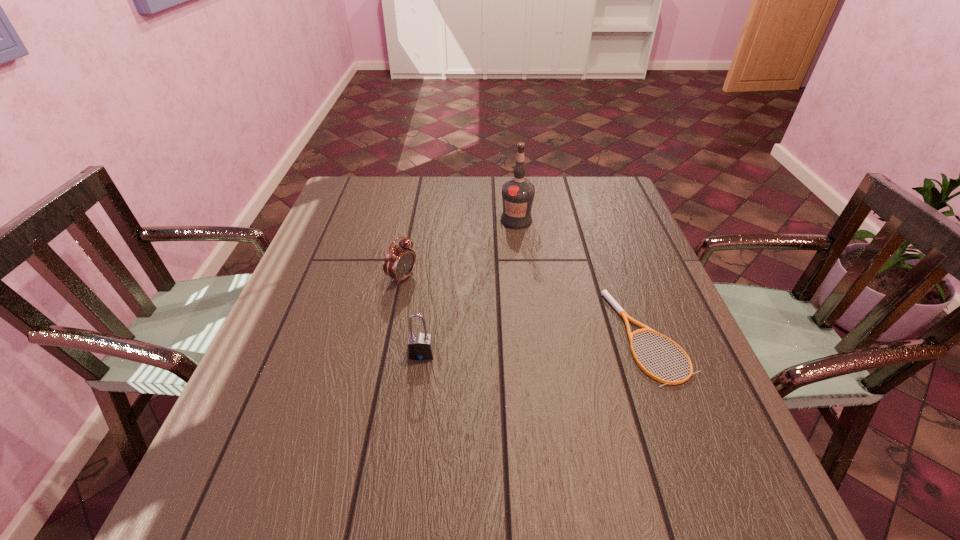
This screenshot has width=960, height=540. In order to click on vacant space at the right edge of the desktop in this screenshot , I will do `click(688, 389)`.

Where is `vacant space at the far left corner of the desktop`? This screenshot has height=540, width=960. vacant space at the far left corner of the desktop is located at coordinates (371, 208).

At what (x,y) coordinates should I click in order to perform the action: click on free spot at the far right corner of the desktop. Please return your answer as a coordinate pair (x, y). The width and height of the screenshot is (960, 540). Looking at the image, I should click on (588, 211).

Identify the location of free space that is in between the third object from left to right and the alarm clock. (459, 249).

The height and width of the screenshot is (540, 960). I want to click on empty space that is in between the farthest object and the tennis racket, so click(583, 278).

The height and width of the screenshot is (540, 960). Find the location of `vacant region between the tallest object and the third object from right to left`. vacant region between the tallest object and the third object from right to left is located at coordinates (469, 287).

At what (x,y) coordinates should I click in order to perform the action: click on empty space between the tennis racket and the leftmost object. Please return your answer as a coordinate pair (x, y). The width and height of the screenshot is (960, 540). Looking at the image, I should click on (525, 307).

Identify the location of unoccupied area between the tallest object and the padlock. (469, 287).

Image resolution: width=960 pixels, height=540 pixels. What are the coordinates of `free space that is in between the second object from left to right and the rightmost object` in the screenshot? It's located at (535, 345).

The image size is (960, 540). Find the location of `free spot between the rightmost object and the tallest object`. free spot between the rightmost object and the tallest object is located at coordinates [583, 278].